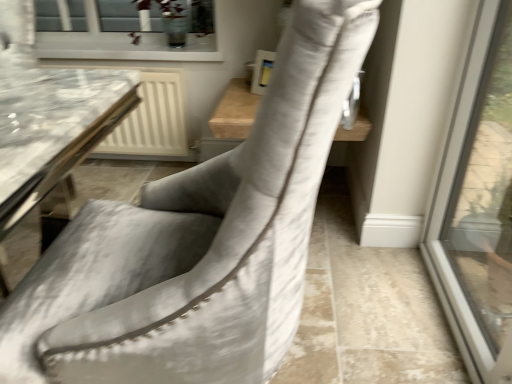
Question: Does suede-like gray chair at center lie in front of green leafy plant at upper center?

Choices:
 (A) no
 (B) yes

Answer: (B)

Question: From the image's perspective, does suede-like gray chair at center appear lower than green leafy plant at upper center?

Choices:
 (A) yes
 (B) no

Answer: (A)

Question: Is suede-like gray chair at center facing towards green leafy plant at upper center?

Choices:
 (A) yes
 (B) no

Answer: (B)

Question: Does suede-like gray chair at center have a lesser height compared to green leafy plant at upper center?

Choices:
 (A) yes
 (B) no

Answer: (B)

Question: Does suede-like gray chair at center have a greater width compared to green leafy plant at upper center?

Choices:
 (A) yes
 (B) no

Answer: (A)

Question: Does suede-like gray chair at center lie behind green leafy plant at upper center?

Choices:
 (A) yes
 (B) no

Answer: (B)

Question: Is suede-like gray chair at center inside green leafy plant at upper center?

Choices:
 (A) no
 (B) yes

Answer: (A)

Question: Can you confirm if green leafy plant at upper center is positioned to the right of suede-like gray chair at center?

Choices:
 (A) yes
 (B) no

Answer: (B)

Question: Does green leafy plant at upper center lie behind suede-like gray chair at center?

Choices:
 (A) no
 (B) yes

Answer: (B)

Question: Is green leafy plant at upper center beside suede-like gray chair at center?

Choices:
 (A) no
 (B) yes

Answer: (A)

Question: Is green leafy plant at upper center facing away from suede-like gray chair at center?

Choices:
 (A) yes
 (B) no

Answer: (B)

Question: From the image's perspective, would you say green leafy plant at upper center is positioned over suede-like gray chair at center?

Choices:
 (A) yes
 (B) no

Answer: (A)

Question: From the image's perspective, relative to suede-like gray chair at center, is green leafy plant at upper center above or below?

Choices:
 (A) below
 (B) above

Answer: (B)